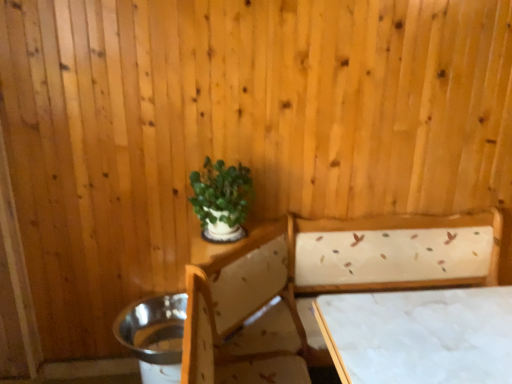
The height and width of the screenshot is (384, 512). Find the location of `free space above white fabric-covered table at lower right (from a real-world perspective)`. free space above white fabric-covered table at lower right (from a real-world perspective) is located at coordinates (437, 331).